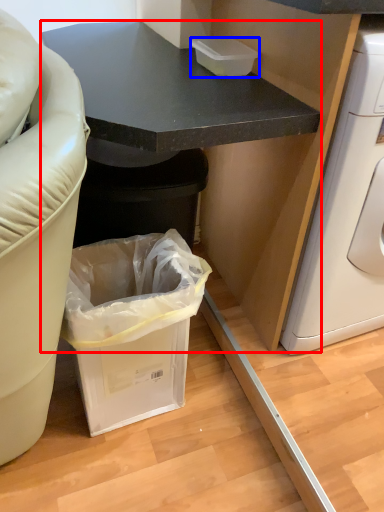
Question: Among these objects, which one is farthest to the camera, cabinetry (highlighted by a red box) or box (highlighted by a blue box)?

Choices:
 (A) cabinetry
 (B) box

Answer: (B)